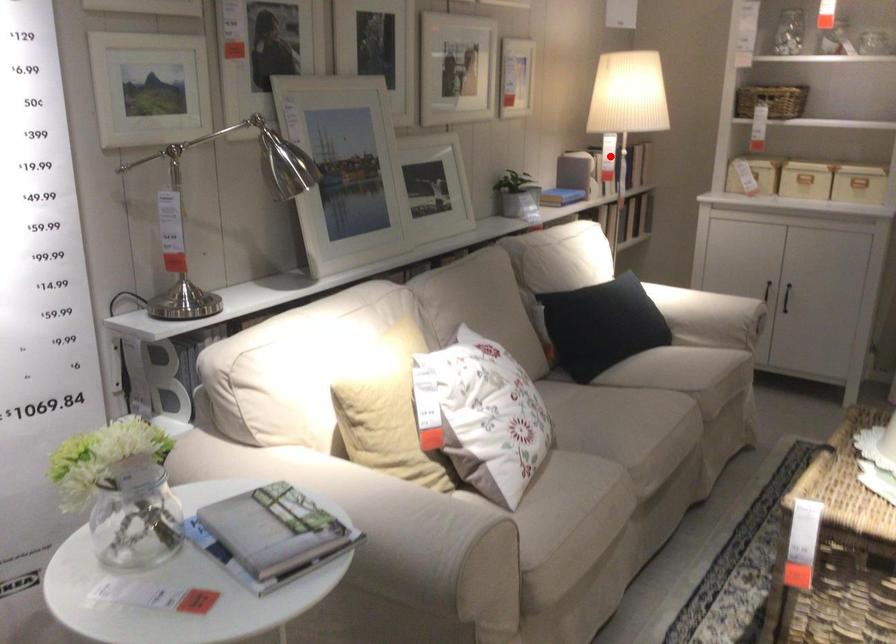
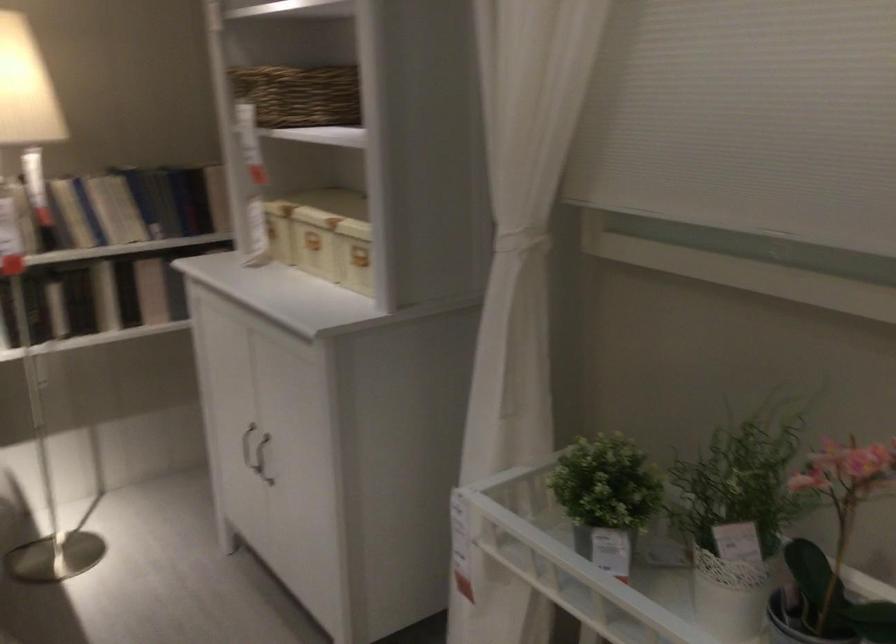
Question: A red point is marked in image1. In image2, is the corresponding 3D point closer to the camera or farther? Reply with the corresponding letter.

Choices:
 (A) The corresponding 3D point is closer.
 (B) The corresponding 3D point is farther.

Answer: (A)